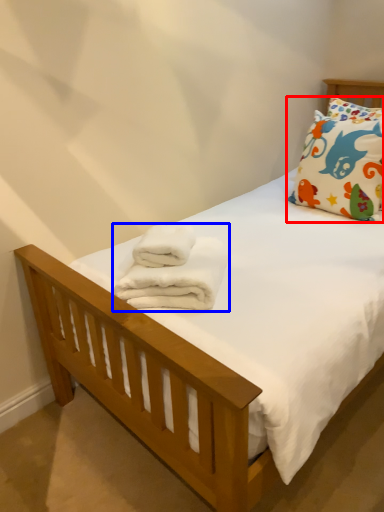
Question: Among these objects, which one is farthest to the camera, pillow (highlighted by a red box) or bath towel (highlighted by a blue box)?

Choices:
 (A) pillow
 (B) bath towel

Answer: (A)